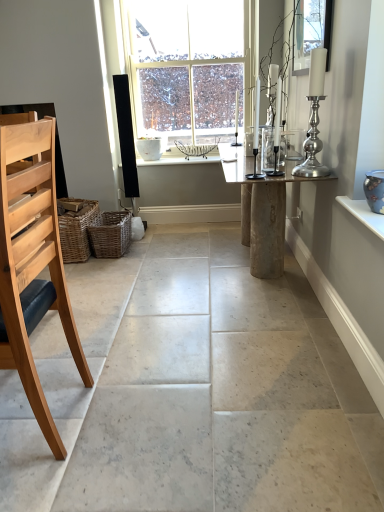
Where is `empty space that is in between natural wood chair at left and rustic wood table at center`? empty space that is in between natural wood chair at left and rustic wood table at center is located at coordinates (180, 329).